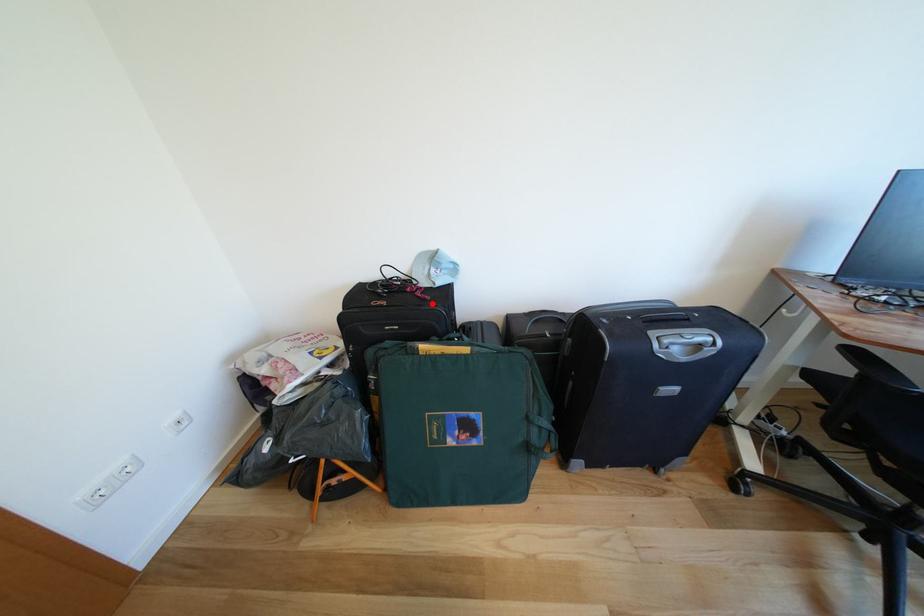
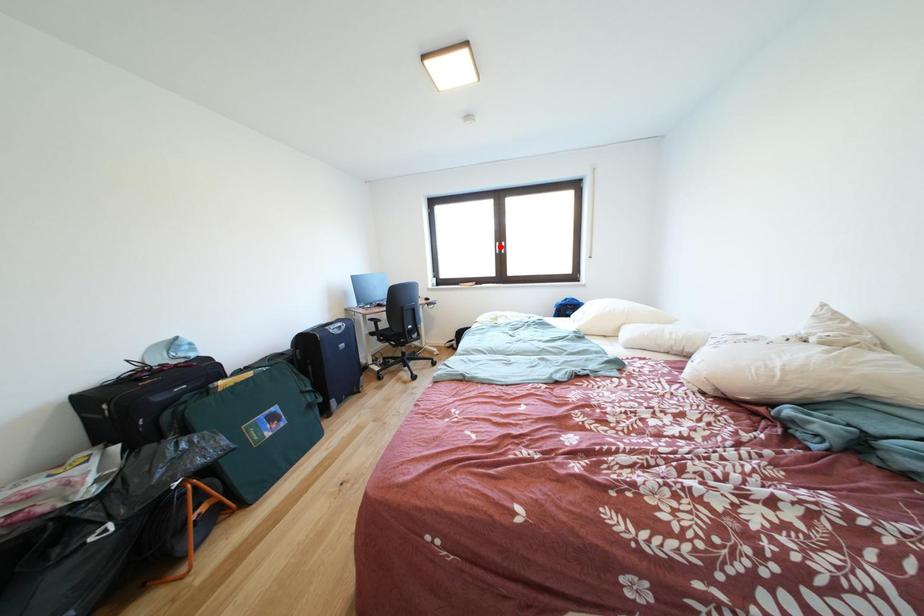
I am providing you with two images of the same scene from different viewpoints. A red point is marked on the first image and another point is marked on the second image. Do the highlighted points in image1 and image2 indicate the same real-world spot?

No